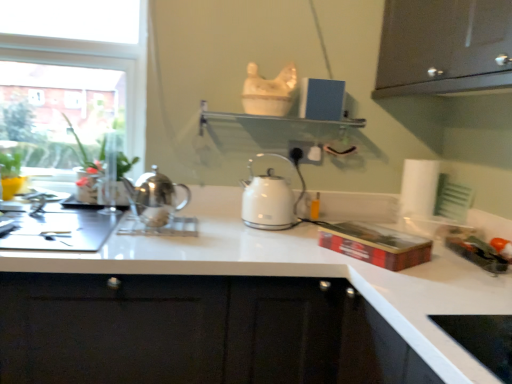
Question: From the image's perspective, relative to transparent glass window at upper left, is white glossy kettle at center, the 2th kettle positioned from the front, above or below?

Choices:
 (A) above
 (B) below

Answer: (B)

Question: Is white glossy kettle at center, placed as the first kettle when sorted from right to left, bigger or smaller than transparent glass window at upper left?

Choices:
 (A) small
 (B) big

Answer: (A)

Question: Which object is the closest to the glossy dark wood cabinet at upper right?

Choices:
 (A) white glossy countertop at center
 (B) white plastic electric outlet at center
 (C) green glossy plant at left
 (D) white paper towel at right
 (E) white glossy kettle at center, placed as the first kettle when sorted from right to left

Answer: (D)

Question: Based on their relative distances, which object is farther from the glossy dark wood cabinet at upper right?

Choices:
 (A) white paper towel at right
 (B) green glossy plant at left
 (C) transparent glass window at upper left
 (D) white glossy shelf at upper center
 (E) polished silver kettle at center, the 1th kettle viewed from the front

Answer: (B)